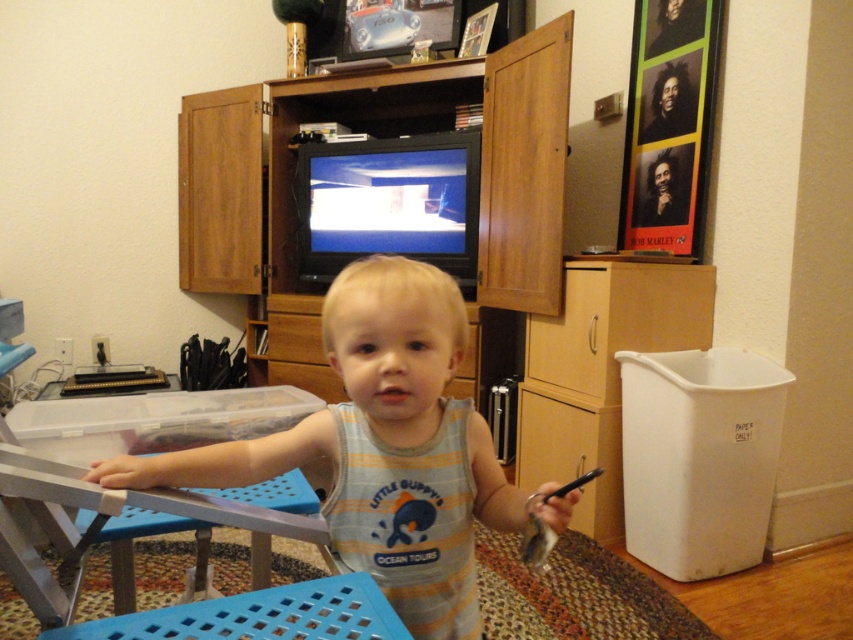
You are a photographer setting up a shoot in this room. You need to focus on the gray striped tank top at center and the wooden entertainment center at center. Which object should you adjust your camera focus to first if you want to capture both in sharp detail?

The gray striped tank top at center is closer to the viewer than the wooden entertainment center at center, so you should focus on the gray striped tank top at center first to ensure both are in sharp detail.

You are a delivery robot standing at the point marked as point [477,461]. You need to deliver a package to the front door, which is 2 meters away from the camera. Can you reach the door without moving from your current position?

The distance of point [477,461] from camera is 1.08 meters, so the door is 2 meters away from the camera. Since you are only 1.08 meters away from the camera, you are closer to the camera than the door. Therefore, you cannot reach the door without moving forward.

You are a guest in this room and want to know which object is shorter between the gray striped tank top at center and the wooden entertainment center at center. Can you tell me?

The gray striped tank top at center is shorter than the wooden entertainment center at center.